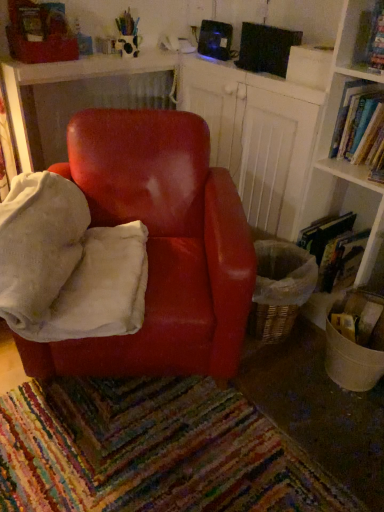
Measure the distance between glossy leather chair at center and camera.

4.00 feet.

What do you see at coordinates (256, 137) in the screenshot? This screenshot has height=512, width=384. I see `wooden bookshelf at upper right` at bounding box center [256, 137].

What do you see at coordinates (335, 250) in the screenshot? The image size is (384, 512). I see `hardcover book at right, positioned as the 2th book in top-to-bottom order` at bounding box center [335, 250].

Where is `glossy leather chair at center`? This screenshot has height=512, width=384. glossy leather chair at center is located at coordinates 161,246.

Does hardcover book at right, placed as the first book when sorted from bottom to top, have a greater height compared to glossy leather chair at center?

In fact, hardcover book at right, placed as the first book when sorted from bottom to top, may be shorter than glossy leather chair at center.

Measure the distance from hardcover book at right, placed as the first book when sorted from bottom to top, to glossy leather chair at center.

A distance of 26.57 inches exists between hardcover book at right, placed as the first book when sorted from bottom to top, and glossy leather chair at center.

Would you consider hardcover book at right, placed as the first book when sorted from bottom to top, to be distant from glossy leather chair at center?

Actually, hardcover book at right, placed as the first book when sorted from bottom to top, and glossy leather chair at center are a little close together.

Which object is thinner, glossy leather chair at center or glossy wood table at center?

Thinner between the two is glossy wood table at center.

From a real-world perspective, is glossy leather chair at center over glossy wood table at center?

Actually, glossy leather chair at center is physically below glossy wood table at center in the real world.

Based on their positions, is glossy leather chair at center located to the left or right of glossy wood table at center?

In the image, glossy leather chair at center appears on the right side of glossy wood table at center.

Are velvety white bean bag at center and glossy wood table at center beside each other?

velvety white bean bag at center and glossy wood table at center are not in contact.

Considering the relative positions of velvety white bean bag at center and glossy wood table at center in the image provided, is velvety white bean bag at center to the left of glossy wood table at center from the viewer's perspective?

In fact, velvety white bean bag at center is to the right of glossy wood table at center.

Consider the image. Is glossy wood table at center inside velvety white bean bag at center?

That's incorrect, glossy wood table at center is not inside velvety white bean bag at center.

Considering the sizes of hardcover book at upper right, which ranks as the 2th book in bottom-to-top order, and wooden bookshelf at upper right in the image, is hardcover book at upper right, which ranks as the 2th book in bottom-to-top order, wider or thinner than wooden bookshelf at upper right?

Clearly, hardcover book at upper right, which ranks as the 2th book in bottom-to-top order, has less width compared to wooden bookshelf at upper right.

What's the angular difference between hardcover book at upper right, positioned as the first book in top-to-bottom order, and wooden bookshelf at upper right's facing directions?

The angle between the facing direction of hardcover book at upper right, positioned as the first book in top-to-bottom order, and the facing direction of wooden bookshelf at upper right is 0.637 degrees.

From the image's perspective, is hardcover book at upper right, which ranks as the 2th book in bottom-to-top order, located above or below wooden bookshelf at upper right?

From the image's perspective, hardcover book at upper right, which ranks as the 2th book in bottom-to-top order, appears above wooden bookshelf at upper right.

Is hardcover book at upper right, which ranks as the 2th book in bottom-to-top order, outside of wooden bookshelf at upper right?

Indeed, hardcover book at upper right, which ranks as the 2th book in bottom-to-top order, is completely outside wooden bookshelf at upper right.

From their relative heights in the image, would you say wooden bookshelf at upper right is taller or shorter than glossy leather chair at center?

Considering their sizes, wooden bookshelf at upper right has more height than glossy leather chair at center.

Which object is positioned more to the right, wooden bookshelf at upper right or glossy leather chair at center?

wooden bookshelf at upper right.

Where is `shelf behind the glossy leather chair at center`? shelf behind the glossy leather chair at center is located at coordinates (256, 137).

Consider the image. Is glossy wood table at center in front of or behind wooden bookshelf at upper right in the image?

glossy wood table at center is positioned farther from the viewer than wooden bookshelf at upper right.

Based on their sizes in the image, would you say glossy wood table at center is bigger or smaller than wooden bookshelf at upper right?

glossy wood table at center is smaller than wooden bookshelf at upper right.

Does point (119, 63) lie in front of point (315, 128)?

No.

Would you say hardcover book at right, placed as the first book when sorted from bottom to top, is outside wooden bookshelf at upper right?

Yes, hardcover book at right, placed as the first book when sorted from bottom to top, is outside of wooden bookshelf at upper right.

How different are the orientations of hardcover book at right, positioned as the 2th book in top-to-bottom order, and wooden bookshelf at upper right in degrees?

The facing directions of hardcover book at right, positioned as the 2th book in top-to-bottom order, and wooden bookshelf at upper right are 0.637 degrees apart.

From a real-world perspective, which object rests below the other?

hardcover book at right, placed as the first book when sorted from bottom to top, is physically lower.

From the image's perspective, is hardcover book at right, positioned as the 2th book in top-to-bottom order, positioned above or below wooden bookshelf at upper right?

Clearly, from the image's perspective, hardcover book at right, positioned as the 2th book in top-to-bottom order, is below wooden bookshelf at upper right.

Image resolution: width=384 pixels, height=512 pixels. In order to click on chair lying in front of the hardcover book at right, positioned as the 2th book in top-to-bottom order in this screenshot , I will do `click(161, 246)`.

You are a GUI agent. You are given a task and a screenshot of the screen. Output one action in this format:
    pyautogui.click(x=<x>, y=<y>)
    Task: Click on the table located on the left of glossy leather chair at center
    The image size is (384, 512).
    Given the screenshot: What is the action you would take?
    pyautogui.click(x=80, y=97)

Looking at the image, which one is located further to hardcover book at right, positioned as the 2th book in top-to-bottom order, glossy leather chair at center or hardcover book at upper right, positioned as the first book in top-to-bottom order?

Based on the image, glossy leather chair at center appears to be further to hardcover book at right, positioned as the 2th book in top-to-bottom order.

When comparing their distances from glossy wood table at center, does hardcover book at upper right, which ranks as the 2th book in bottom-to-top order, or hardcover book at right, positioned as the 2th book in top-to-bottom order, seem closer?

hardcover book at upper right, which ranks as the 2th book in bottom-to-top order, is positioned closer to the anchor glossy wood table at center.

Looking at the image, which one is located further to velvety white bean bag at center, glossy leather chair at center or glossy wood table at center?

The object further to velvety white bean bag at center is glossy wood table at center.

When comparing their distances from glossy leather chair at center, does wooden bookshelf at upper right or velvety white bean bag at center seem closer?

velvety white bean bag at center lies closer to glossy leather chair at center than the other object.

Which object lies nearer to the anchor point hardcover book at upper right, which ranks as the 2th book in bottom-to-top order, hardcover book at right, positioned as the 2th book in top-to-bottom order, or glossy wood table at center?

The object closer to hardcover book at upper right, which ranks as the 2th book in bottom-to-top order, is hardcover book at right, positioned as the 2th book in top-to-bottom order.

Estimate the real-world distances between objects in this image. Which object is further from hardcover book at right, placed as the first book when sorted from bottom to top, glossy leather chair at center or glossy wood table at center?

glossy wood table at center is further to hardcover book at right, placed as the first book when sorted from bottom to top.

Looking at the image, which one is located further to wooden bookshelf at upper right, hardcover book at upper right, which ranks as the 2th book in bottom-to-top order, or velvety white bean bag at center?

velvety white bean bag at center is positioned further to the anchor wooden bookshelf at upper right.

Looking at the image, which one is located closer to velvety white bean bag at center, hardcover book at right, positioned as the 2th book in top-to-bottom order, or glossy leather chair at center?

The object closer to velvety white bean bag at center is glossy leather chair at center.

At what (x,y) coordinates should I click in order to perform the action: click on chair between velvety white bean bag at center and hardcover book at upper right, positioned as the first book in top-to-bottom order. Please return your answer as a coordinate pair (x, y). The image size is (384, 512). Looking at the image, I should click on (161, 246).

This screenshot has height=512, width=384. I want to click on chair positioned between velvety white bean bag at center and glossy wood table at center from near to far, so click(x=161, y=246).

Locate an element on the screen. The height and width of the screenshot is (512, 384). book between velvety white bean bag at center and hardcover book at upper right, which ranks as the 2th book in bottom-to-top order, in the horizontal direction is located at coordinates (335, 250).

This screenshot has height=512, width=384. In order to click on shelf between velvety white bean bag at center and glossy wood table at center along the z-axis in this screenshot , I will do `click(256, 137)`.